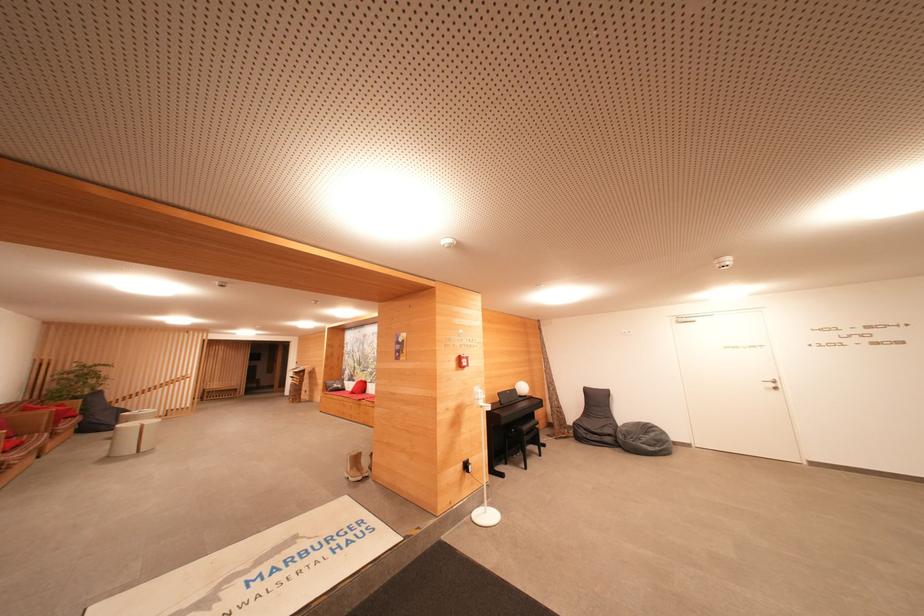
Locate an element on the screen. red fire alarm is located at coordinates (462, 361).